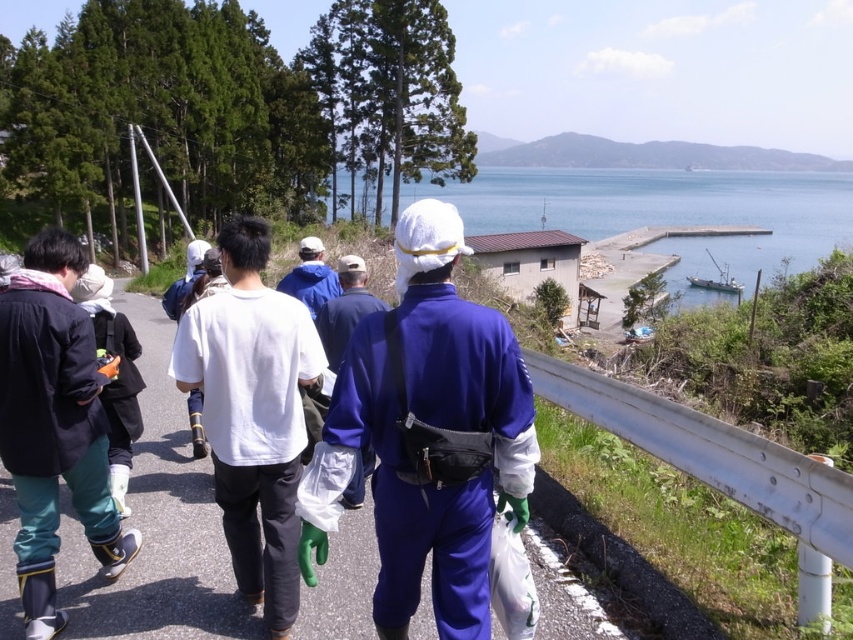
Question: Does blue fabric uniform at center appear over blue fabric bag at center?

Choices:
 (A) no
 (B) yes

Answer: (A)

Question: Estimate the real-world distances between objects in this image. Which object is farther from the blue fabric bag at center?

Choices:
 (A) white fabric shirt at center
 (B) blue fabric jacket at center
 (C) matte black jacket at left

Answer: (A)

Question: Is blue fabric uniform at center to the right of white fabric shirt at center from the viewer's perspective?

Choices:
 (A) yes
 (B) no

Answer: (A)

Question: Is blue fabric highway at center below matte black jacket at left?

Choices:
 (A) yes
 (B) no

Answer: (A)

Question: Among these points, which one is nearest to the camera?

Choices:
 (A) (360, 593)
 (B) (325, 288)
 (C) (289, 397)

Answer: (C)

Question: Among these points, which one is farthest from the camera?

Choices:
 (A) (407, 384)
 (B) (573, 176)
 (C) (15, 605)

Answer: (B)